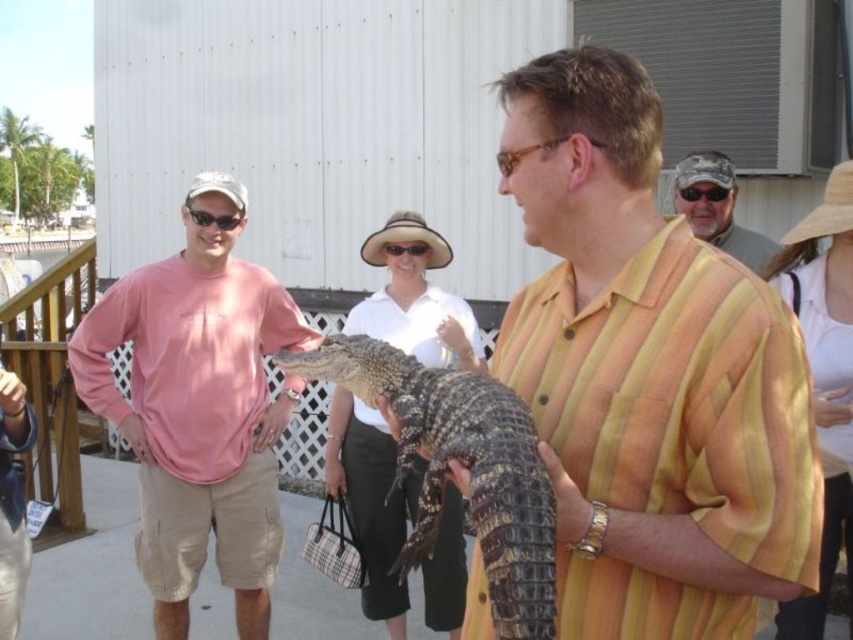
You are standing at the origin of a coordinate system placed at the bottom left corner of the image. The coordinates provided in the scene are normalized between 0 and 1. A scaly brown alligator is located at point (462,464). If you want to walk directly to the alligator, which direction should you move from your current position at the origin?

Since the alligator is at coordinates 0.725 in the x and 0.543 in the y, and you are at the origin, you should move northeast to reach it.

You are standing at the point with coordinates point [724,157] and want to walk towards the point [195,456]. Which direction should you move?

You should move forward because point [195,456] is in front of point [724,157].

You are standing at the point marked by the coordinates point (199, 406) in the image. Looking around, you notice a man in a yellow striped shirt holding an alligator. Which direction should you walk to reach the man in the yellow striped shirt?

The point (199, 406) marks the pink long sleeve shirt at left. To reach the man in the yellow striped shirt holding an alligator, you should walk to the right from the pink long sleeve shirt at left since he is positioned to the right of that location.